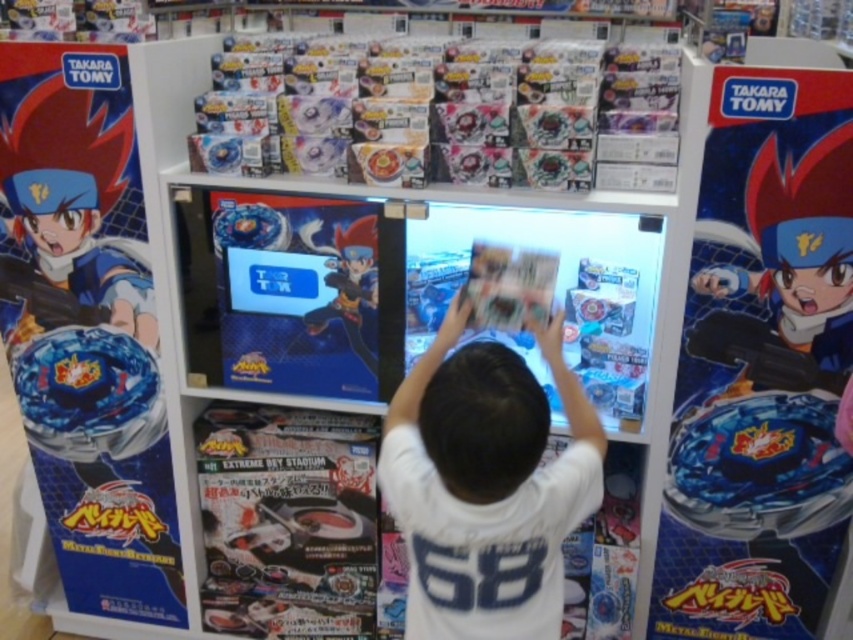
Can you confirm if white cotton shirt at center is bigger than shiny blue figure at center?

Yes.

Who is taller, white cotton shirt at center or shiny blue figure at center?

white cotton shirt at center is taller.

Locate an element on the screen. This screenshot has height=640, width=853. white cotton shirt at center is located at coordinates (486, 484).

Where is `white cotton shirt at center`? white cotton shirt at center is located at coordinates (486, 484).